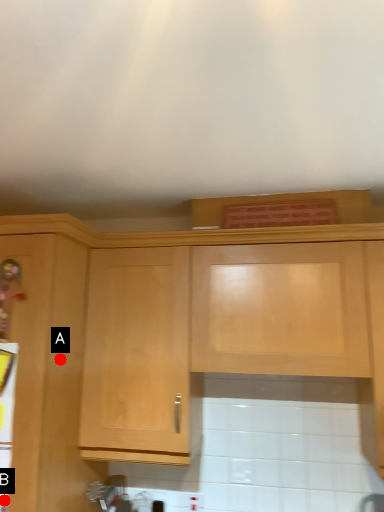
Question: Two points are circled on the image, labeled by A and B beside each circle. Which point is farther to the camera?

Choices:
 (A) A is further
 (B) B is further

Answer: (A)